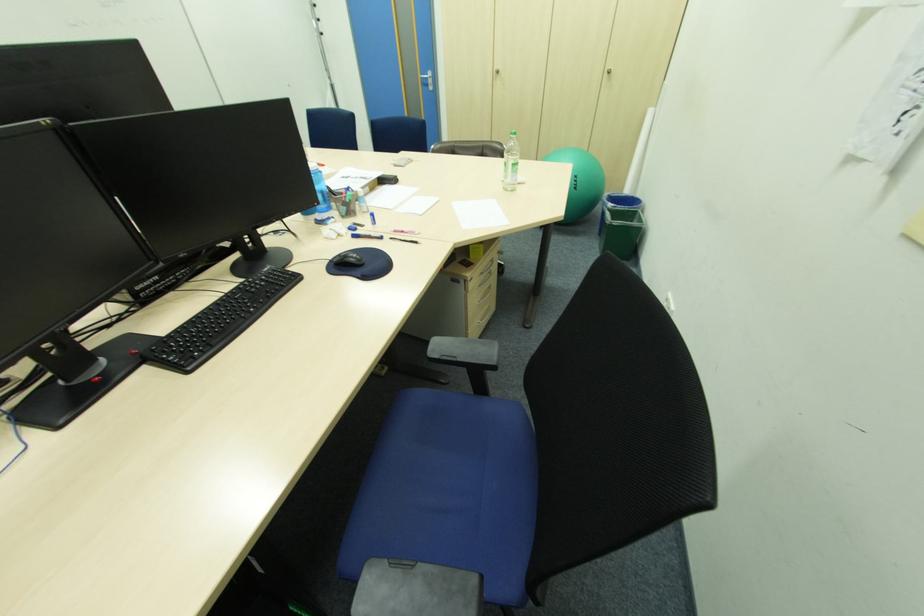
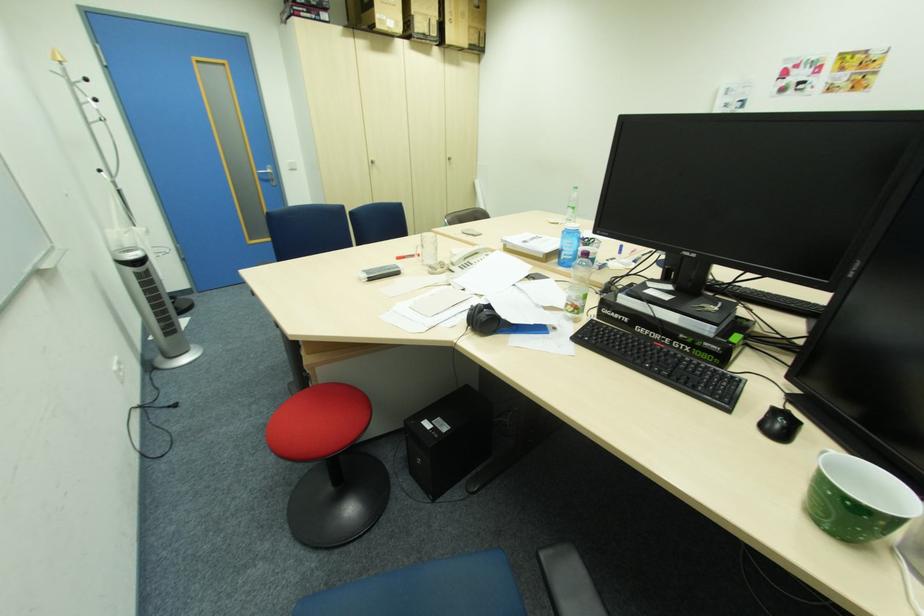
Question: I am providing you with two images of the same scene from different viewpoints. Which of the following objects are not visible in image2?

Choices:
 (A) green exercise ball
 (B) black headphones
 (C) black computer mouse
 (D) blue flip-top cap

Answer: (A)